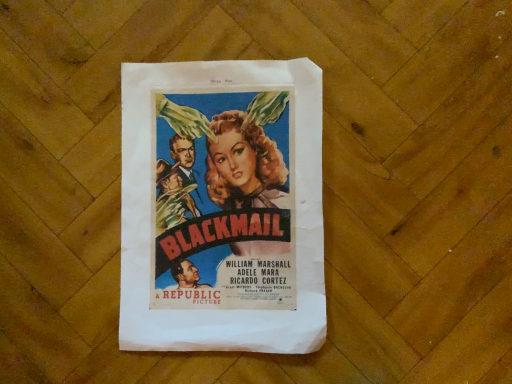
In order to face matte paper poster at center, should I rotate leftwards or rightwards?

A 4.772 degree turn to the left will do.

Describe the element at coordinates (151, 216) in the screenshot. I see `matte paper poster at center` at that location.

Image resolution: width=512 pixels, height=384 pixels. I want to click on matte paper poster at center, so click(x=151, y=216).

What is the approximate width of matte paper poster at center?

matte paper poster at center is 12.19 inches in width.

Identify the location of matte paper poster at center. (151, 216).